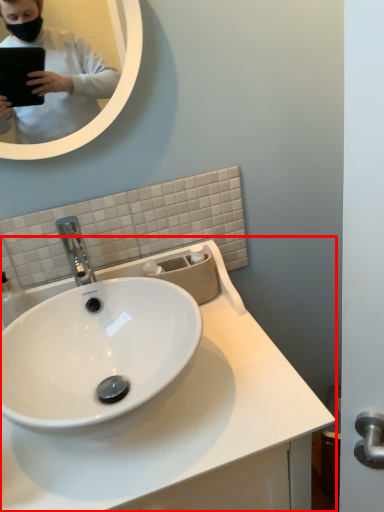
Question: In this image, where is sink (annotated by the red box) located relative to mirror?

Choices:
 (A) left
 (B) right

Answer: (B)